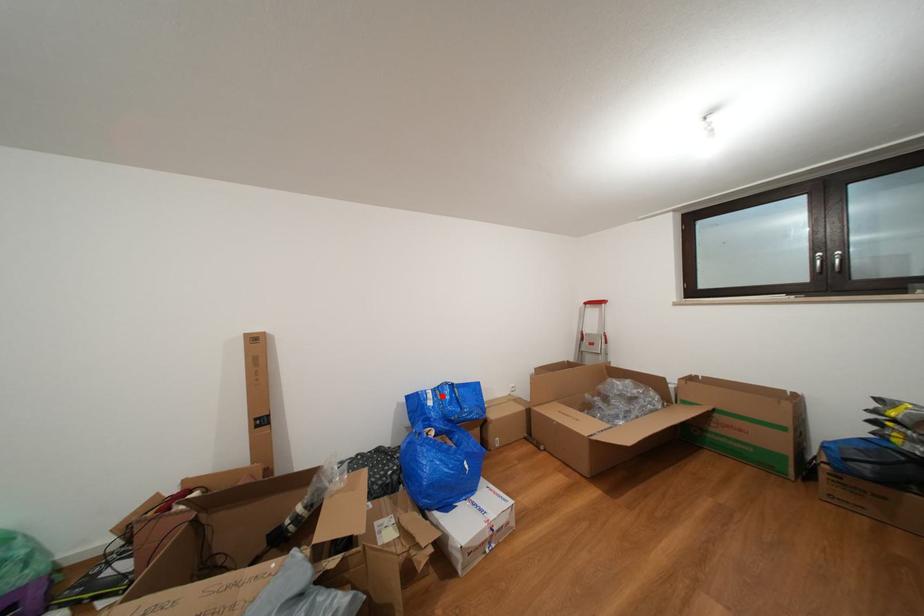
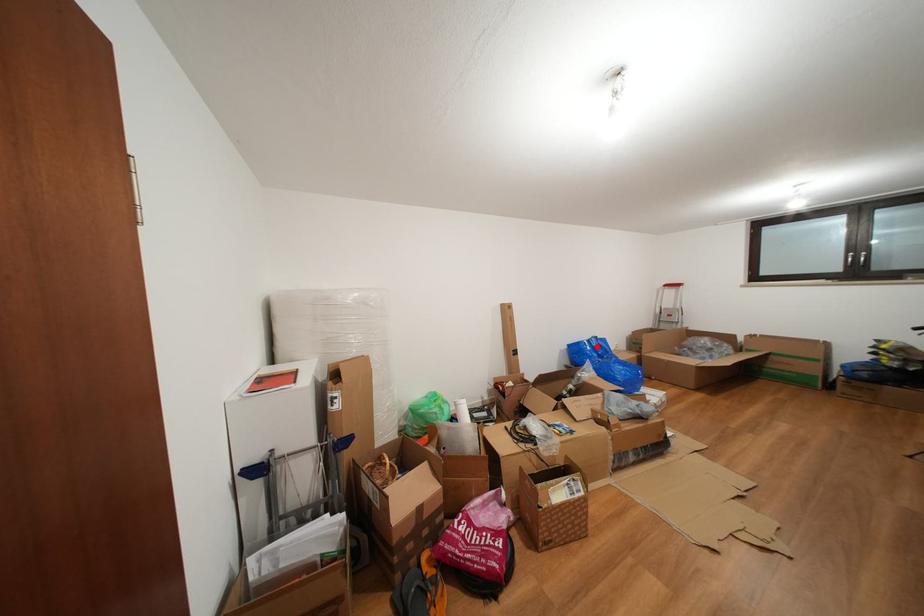
I am providing you with two images of the same scene from different viewpoints. A red point is marked on the first image and another point is marked on the second image. Does the point marked in image1 correspond to the same location as the one in image2?

Yes